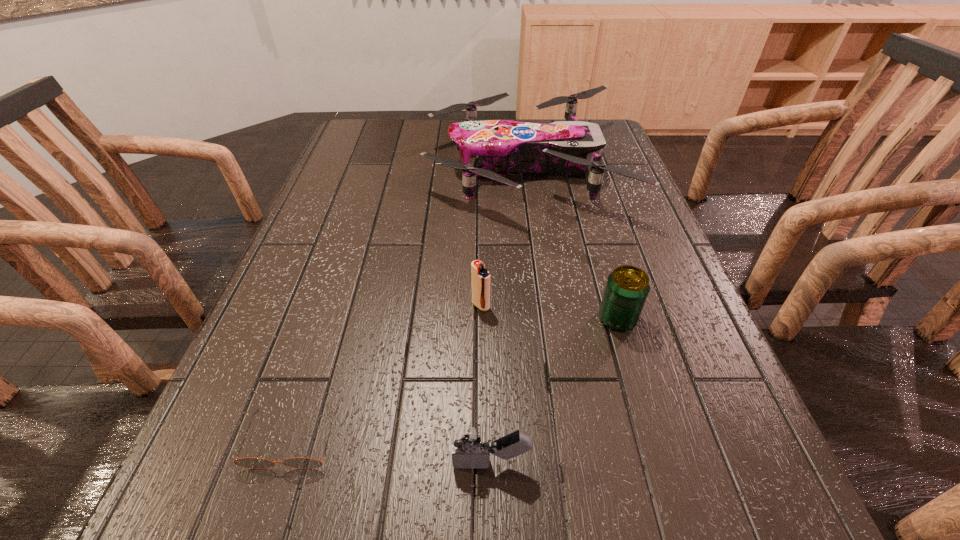
I want to click on vacant space at the right edge of the desktop, so click(x=678, y=273).

Where is `free space at the far left corner of the desktop`? The height and width of the screenshot is (540, 960). free space at the far left corner of the desktop is located at coordinates (391, 129).

Identify the location of free spot between the farther igniter and the leftmost object. Image resolution: width=960 pixels, height=540 pixels. (386, 373).

You are a GUI agent. You are given a task and a screenshot of the screen. Output one action in this format:
    pyautogui.click(x=<x>, y=<y>)
    Task: Click on the free space between the nearer igniter and the farther igniter
    The height and width of the screenshot is (540, 960).
    Given the screenshot: What is the action you would take?
    pyautogui.click(x=486, y=384)

Where is `free space between the farther igniter and the shortest object`? The height and width of the screenshot is (540, 960). free space between the farther igniter and the shortest object is located at coordinates (386, 373).

Image resolution: width=960 pixels, height=540 pixels. I want to click on vacant area between the nearer igniter and the shortest object, so (392, 451).

Where is `unoccupied position between the beer can and the shortest object`? unoccupied position between the beer can and the shortest object is located at coordinates (455, 379).

Where is `free point between the farther igniter and the farthest object`? This screenshot has width=960, height=540. free point between the farther igniter and the farthest object is located at coordinates coord(502,237).

Where is `free space that is in between the nearer igniter and the drone`? Image resolution: width=960 pixels, height=540 pixels. free space that is in between the nearer igniter and the drone is located at coordinates (507, 316).

In order to click on empty space that is in between the sunglasses and the beer can in this screenshot , I will do `click(455, 379)`.